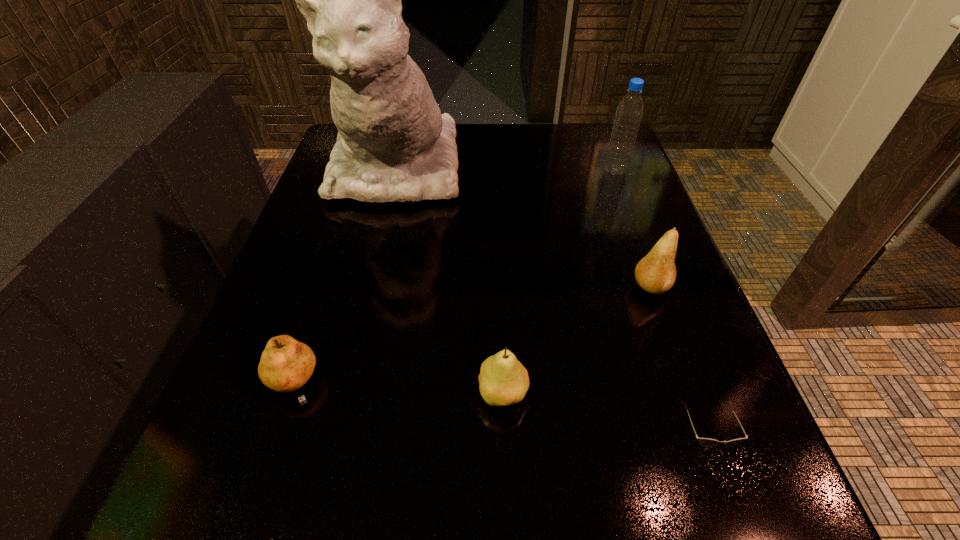
Locate an element on the screen. This screenshot has width=960, height=540. object that is at the far left corner is located at coordinates (393, 144).

Locate an element on the screen. object at the far right corner is located at coordinates (629, 112).

Locate an element on the screen. The height and width of the screenshot is (540, 960). free spot at the far edge of the desktop is located at coordinates [x=463, y=156].

Find the location of `vacant space at the near edge of the desktop`. vacant space at the near edge of the desktop is located at coordinates (344, 532).

You are a GUI agent. You are given a task and a screenshot of the screen. Output one action in this format:
    pyautogui.click(x=<x>, y=<y>)
    Task: Click on the free location at the left edge
    This screenshot has height=540, width=960.
    Given the screenshot: What is the action you would take?
    pyautogui.click(x=280, y=316)

Identify the location of free space at the right edge of the desktop. (637, 308).

In the image, there is a desktop. Where is `vacant region at the near left corner`? The image size is (960, 540). vacant region at the near left corner is located at coordinates (204, 539).

Locate an element on the screen. The height and width of the screenshot is (540, 960). blank space at the far right corner is located at coordinates (599, 151).

Find the location of a particular element. blank area at the near right corner is located at coordinates (674, 517).

At what (x,y) coordinates should I click in order to perform the action: click on free space between the cat and the fifth shortest object. Please return your answer as a coordinate pair (x, y). This screenshot has height=540, width=960. Looking at the image, I should click on (506, 169).